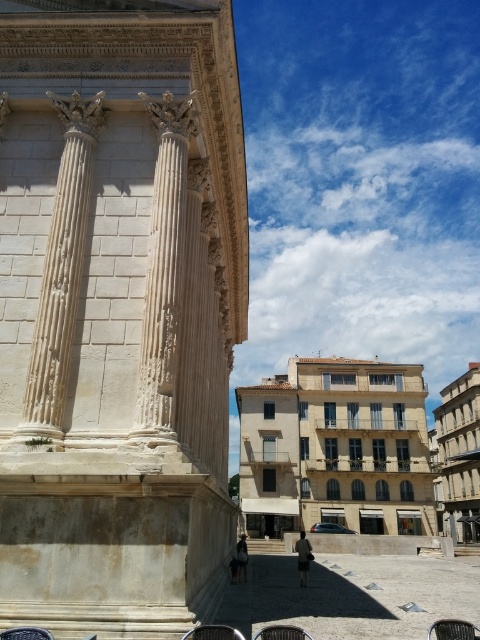
You are standing in the scene and want to move from the brown woven chair at lower left to the white marble column at center. Which direction should you move?

To move from the brown woven chair at lower left to the white marble column at center, you should move to the right since the white marble column at center is to the right of the brown woven chair at lower left.

You are standing at the point with coordinates point (213,632). What object are you standing on?

You are standing on the metallic black chair at lower center.